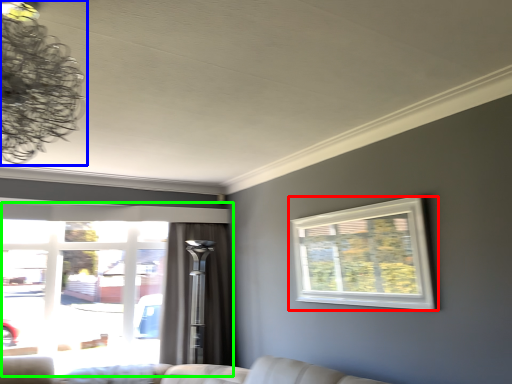
Question: Estimate the real-world distances between objects in this image. Which object is closer to window (highlighted by a red box), lamp (highlighted by a blue box) or window (highlighted by a green box)?

Choices:
 (A) lamp
 (B) window

Answer: (A)